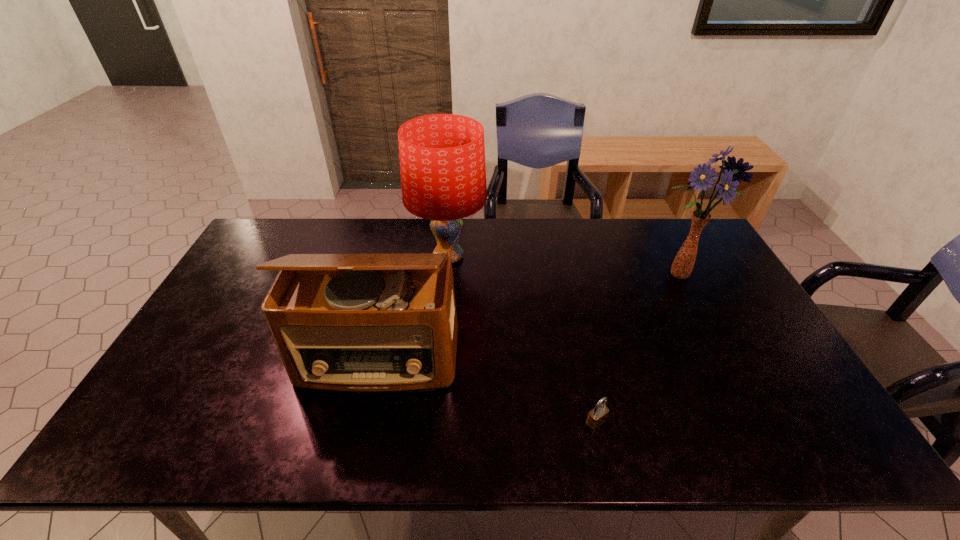
Where is `free space between the second object from right to left and the lampshade`? The height and width of the screenshot is (540, 960). free space between the second object from right to left and the lampshade is located at coordinates (522, 340).

The image size is (960, 540). In order to click on free space that is in between the third object from left to right and the flower arrangement in this screenshot , I will do [636, 348].

This screenshot has width=960, height=540. Find the location of `free spot between the rightmost object and the third object from left to right`. free spot between the rightmost object and the third object from left to right is located at coordinates (636, 348).

The image size is (960, 540). I want to click on unoccupied position between the flower arrangement and the third object from left to right, so click(636, 348).

This screenshot has height=540, width=960. I want to click on empty space that is in between the second shortest object and the rightmost object, so click(x=528, y=317).

This screenshot has height=540, width=960. I want to click on vacant area between the nearest object and the lampshade, so click(x=522, y=340).

This screenshot has width=960, height=540. In order to click on free space between the nearest object and the lampshade in this screenshot , I will do `click(522, 340)`.

At what (x,y) coordinates should I click in order to perform the action: click on object that stands as the second closest to the shortest object. Please return your answer as a coordinate pair (x, y). Looking at the image, I should click on 682,266.

Select which object appears as the second closest to the third farthest object. Please provide its 2D coordinates. Your answer should be formatted as a tuple, i.e. [(x, y)], where the tuple contains the x and y coordinates of a point satisfying the conditions above.

[(597, 416)]

At what (x,y) coordinates should I click in order to perform the action: click on vacant space that satisfies the following two spatial constraints: 1. on the front-facing side of the lampshade; 2. on the right side of the padlock. Please return your answer as a coordinate pair (x, y). Looking at the image, I should click on (434, 422).